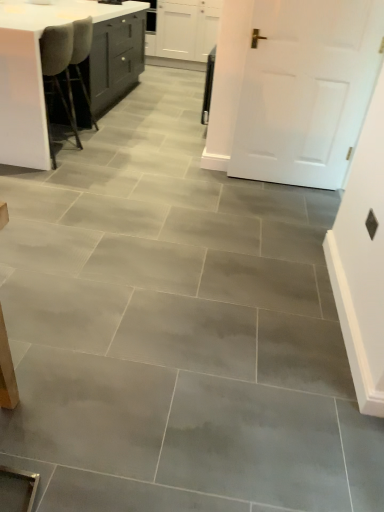
Question: Is white glossy table at upper left at the back of white matte cabinet at upper center?

Choices:
 (A) yes
 (B) no

Answer: (B)

Question: Is white glossy table at upper left surrounded by white matte cabinet at upper center?

Choices:
 (A) yes
 (B) no

Answer: (B)

Question: From a real-world perspective, is white matte cabinet at upper center on top of white glossy table at upper left?

Choices:
 (A) no
 (B) yes

Answer: (B)

Question: Considering the relative sizes of white matte cabinet at upper center and white glossy table at upper left in the image provided, is white matte cabinet at upper center smaller than white glossy table at upper left?

Choices:
 (A) yes
 (B) no

Answer: (A)

Question: From the image's perspective, is white matte cabinet at upper center under white glossy table at upper left?

Choices:
 (A) yes
 (B) no

Answer: (B)

Question: Is point (215, 9) positioned closer to the camera than point (266, 51)?

Choices:
 (A) farther
 (B) closer

Answer: (A)

Question: In terms of height, does white matte cabinet at upper center look taller or shorter compared to white matte door at upper right?

Choices:
 (A) tall
 (B) short

Answer: (B)

Question: Is white matte cabinet at upper center wider or thinner than white matte door at upper right?

Choices:
 (A) thin
 (B) wide

Answer: (B)

Question: Based on their positions, is white matte cabinet at upper center located to the left or right of white matte door at upper right?

Choices:
 (A) left
 (B) right

Answer: (A)

Question: Visually, is white matte cabinet at upper center positioned to the left or to the right of white glossy table at upper left?

Choices:
 (A) right
 (B) left

Answer: (A)

Question: Relative to white glossy table at upper left, is white matte cabinet at upper center in front or behind?

Choices:
 (A) behind
 (B) front

Answer: (A)

Question: Considering the positions of white matte cabinet at upper center and white glossy table at upper left in the image, is white matte cabinet at upper center wider or thinner than white glossy table at upper left?

Choices:
 (A) thin
 (B) wide

Answer: (A)

Question: From a real-world perspective, is white matte cabinet at upper center above or below white glossy table at upper left?

Choices:
 (A) below
 (B) above

Answer: (B)

Question: In terms of size, does white glossy table at upper left appear bigger or smaller than white matte door at upper right?

Choices:
 (A) big
 (B) small

Answer: (A)

Question: Is point (36, 88) positioned closer to the camera than point (283, 53)?

Choices:
 (A) closer
 (B) farther

Answer: (B)